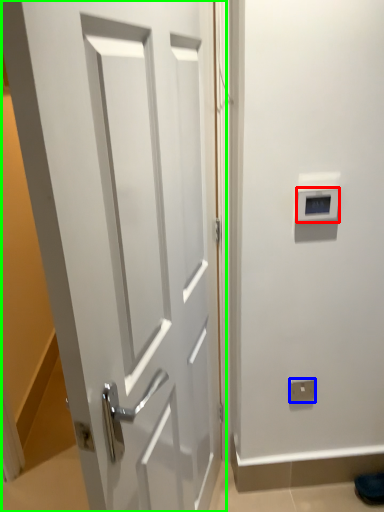
Question: Estimate the real-world distances between objects in this image. Which object is farther from thermostat (highlighted by a red box), electric outlet (highlighted by a blue box) or door (highlighted by a green box)?

Choices:
 (A) electric outlet
 (B) door

Answer: (A)